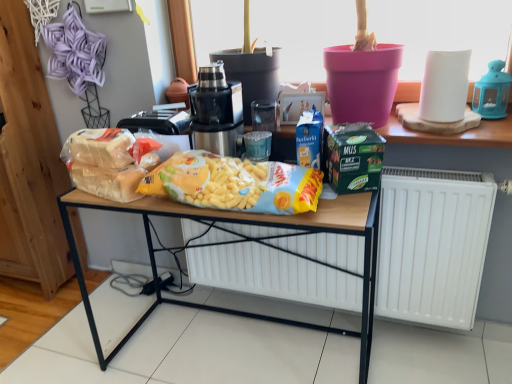
Question: Does point (116, 168) appear closer or farther from the camera than point (285, 185)?

Choices:
 (A) closer
 (B) farther

Answer: (B)

Question: In the image, is translucent plastic bag at center, the first waste from the left, on the left side or the right side of yellow matte snack packet at center, which is the 2th waste from left to right?

Choices:
 (A) right
 (B) left

Answer: (B)

Question: Considering the real-world distances, which object is farthest from the black metallic juicer at center?

Choices:
 (A) green matte lunch box at center
 (B) translucent plastic bag at center, the first waste from the left
 (C) wooden shelf at upper center
 (D) yellow matte snack packet at center, which is the 2th waste from left to right
 (E) blue plastic lantern at upper right

Answer: (E)

Question: Which object is the closest to the black metallic juicer at center?

Choices:
 (A) white matte radiator at lower center
 (B) translucent plastic bag at center, the first waste from the left
 (C) wooden table at center
 (D) green matte lunch box at center
 (E) wooden shelf at upper center

Answer: (B)